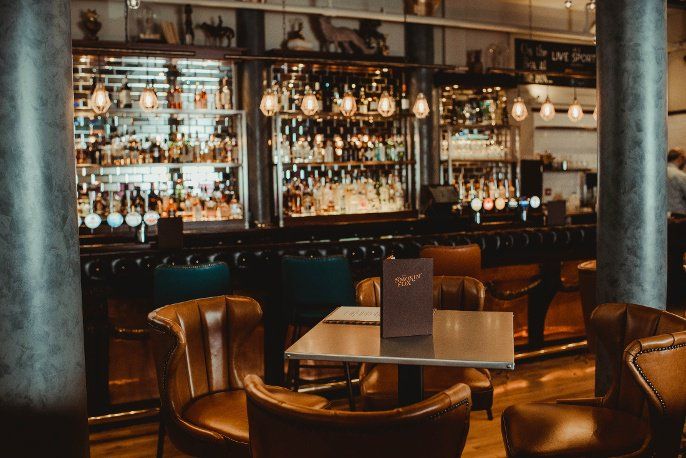
You are a GUI agent. You are given a task and a screenshot of the screen. Output one action in this format:
    pyautogui.click(x=<x>, y=<y>)
    Task: Click on the chairs
    
    Given the screenshot: What is the action you would take?
    pyautogui.click(x=348, y=419), pyautogui.click(x=202, y=341), pyautogui.click(x=472, y=291), pyautogui.click(x=459, y=255), pyautogui.click(x=300, y=284), pyautogui.click(x=191, y=275), pyautogui.click(x=663, y=376), pyautogui.click(x=584, y=273)